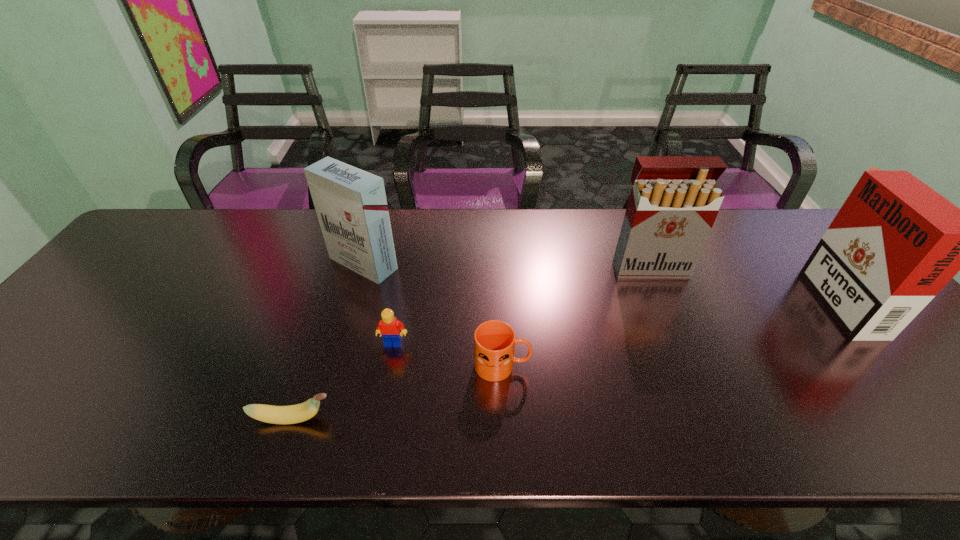
The width and height of the screenshot is (960, 540). In order to click on the second cigarette case from left to right in this screenshot , I will do `click(674, 201)`.

The width and height of the screenshot is (960, 540). I want to click on the rightmost object, so click(x=895, y=243).

Identify the location of the leftmost cigarette case. The width and height of the screenshot is (960, 540). (351, 205).

The height and width of the screenshot is (540, 960). I want to click on Lego, so click(x=389, y=327).

The width and height of the screenshot is (960, 540). I want to click on mug, so click(x=494, y=341).

Locate an element on the screen. the fifth farthest object is located at coordinates (494, 341).

Where is `the shortest object`? Image resolution: width=960 pixels, height=540 pixels. the shortest object is located at coordinates (291, 414).

This screenshot has height=540, width=960. Identify the location of banana. (291, 414).

Locate an element on the screen. This screenshot has width=960, height=540. vacant region located 0.190m with the lid open on the second cigarette case from left to right is located at coordinates (676, 331).

The image size is (960, 540). I want to click on vacant space situated on the front-facing side of the rightmost cigarette case, so click(750, 296).